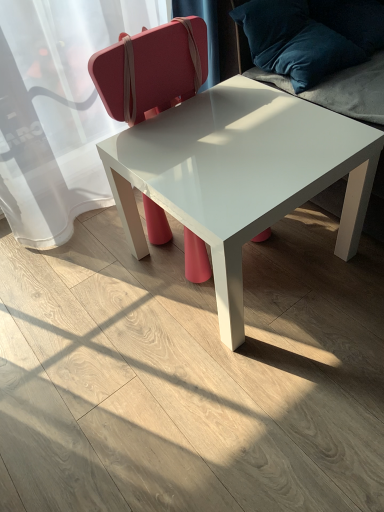
Question: Considering the positions of point (150, 241) and point (309, 99), is point (150, 241) closer or farther from the camera than point (309, 99)?

Choices:
 (A) closer
 (B) farther

Answer: (B)

Question: Visually, is matte pink suitcase at center positioned to the left or to the right of velvet blue pillow at upper right?

Choices:
 (A) right
 (B) left

Answer: (B)

Question: Which of these objects is positioned farthest from the white glossy table at center?

Choices:
 (A) matte pink suitcase at center
 (B) velvet blue pillow at upper right

Answer: (A)

Question: Which is farther from the matte pink suitcase at center?

Choices:
 (A) white glossy table at center
 (B) velvet blue pillow at upper right

Answer: (B)